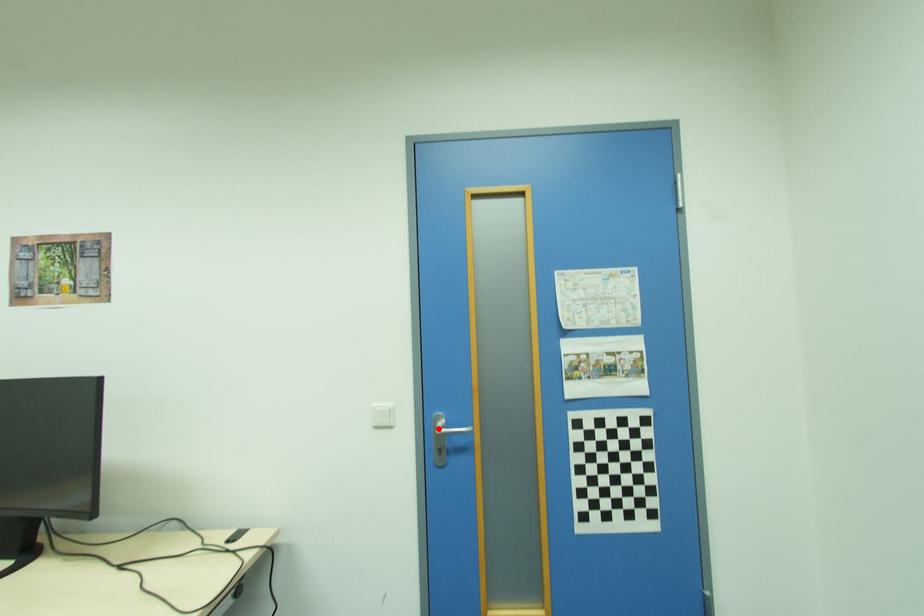
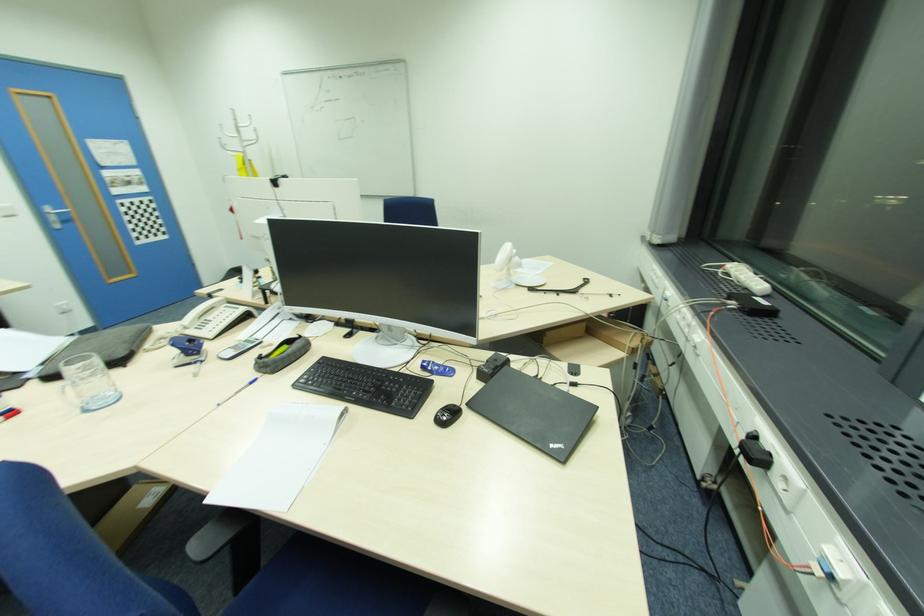
Where in the second image is the point corresponding to the highlighted location from the first image?

(54, 213)